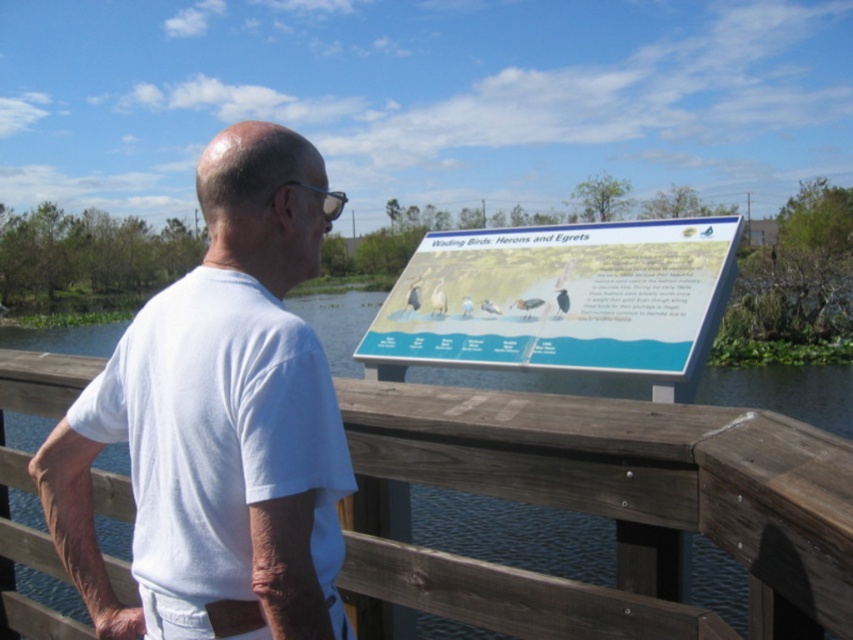
Can you confirm if white cotton shirt at center is bigger than blue glossy signboard at center?

Correct, white cotton shirt at center is larger in size than blue glossy signboard at center.

Is white cotton shirt at center smaller than blue glossy signboard at center?

Incorrect, white cotton shirt at center is not smaller in size than blue glossy signboard at center.

Between point (316, 531) and point (456, 248), which one is positioned behind?

Positioned behind is point (456, 248).

The width and height of the screenshot is (853, 640). In order to click on white cotton shirt at center in this screenshot , I will do `click(219, 406)`.